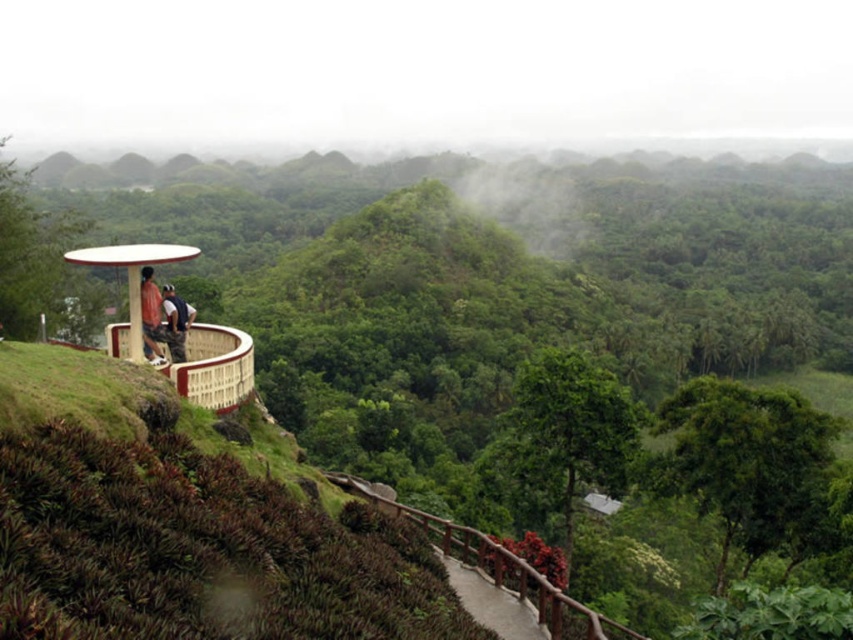
Question: Among these points, which one is farthest from the camera?

Choices:
 (A) (151, 332)
 (B) (178, 362)
 (C) (503, 611)

Answer: (B)

Question: Which object appears farthest from the camera in this image?

Choices:
 (A) dark blue shirt at upper center
 (B) matte red shirt at center

Answer: (A)

Question: Which point is closer to the camera?

Choices:
 (A) (170, 298)
 (B) (148, 284)
 (C) (450, 566)

Answer: (C)

Question: Can you confirm if dark blue shirt at upper center is positioned above matte red shirt at center?

Choices:
 (A) yes
 (B) no

Answer: (A)

Question: Where is concrete wooden railing at lower center located in relation to dark blue shirt at upper center in the image?

Choices:
 (A) right
 (B) left

Answer: (A)

Question: Is concrete wooden railing at lower center smaller than matte red shirt at center?

Choices:
 (A) no
 (B) yes

Answer: (B)